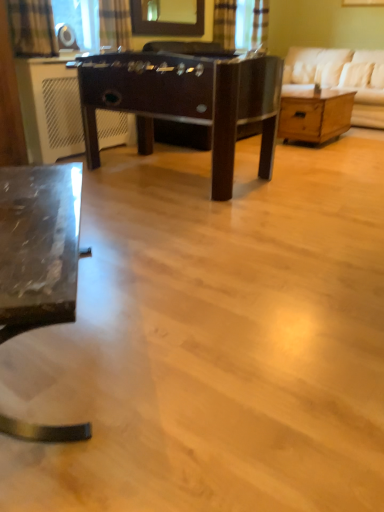
The height and width of the screenshot is (512, 384). I want to click on plaid fabric curtain at upper center, the 1th curtain from the back, so click(224, 23).

Where is `plaid fabric curtain at upper center, positioned as the 2th curtain in bottom-to-top order`? Image resolution: width=384 pixels, height=512 pixels. plaid fabric curtain at upper center, positioned as the 2th curtain in bottom-to-top order is located at coordinates (115, 24).

Locate an element on the screen. The width and height of the screenshot is (384, 512). white fabric couch at upper right is located at coordinates (342, 77).

Image resolution: width=384 pixels, height=512 pixels. What are the coordinates of `wooden drawer at right, arranged as the 1th table when viewed from the right` in the screenshot? It's located at pyautogui.click(x=314, y=114).

Identify the location of metallic glass desk at lower left. (39, 245).

This screenshot has width=384, height=512. What do you see at coordinates (32, 28) in the screenshot?
I see `plaid fabric curtain at upper left, which is the first curtain from bottom to top` at bounding box center [32, 28].

You are a GUI agent. You are given a task and a screenshot of the screen. Output one action in this format:
    pyautogui.click(x=<x>, y=<y>)
    Task: Click on the plaid fabric curtain at upper left, the third curtain when ordered from right to left
    
    Given the screenshot: What is the action you would take?
    pyautogui.click(x=32, y=28)

What do you see at coordinates (185, 101) in the screenshot? This screenshot has width=384, height=512. I see `dark brown wood foosball table at center, placed as the 2th table when sorted from back to front` at bounding box center [185, 101].

What are the coordinates of `plaid fabric curtain at upper center, which ranks as the third curtain in front-to-back order` in the screenshot? It's located at click(x=224, y=23).

There is a plaid fabric curtain at upper left, which appears as the 1th curtain when viewed from the front. Where is `mirror above it (from a real-world perspective)`? This screenshot has height=512, width=384. mirror above it (from a real-world perspective) is located at coordinates (168, 17).

Which object is closer to the camera, glossy glass mirror at upper center or plaid fabric curtain at upper left, the third curtain when ordered from right to left?

Positioned in front is plaid fabric curtain at upper left, the third curtain when ordered from right to left.

From a real-world perspective, is glossy glass mirror at upper center positioned under plaid fabric curtain at upper left, which is counted as the 1th curtain, starting from the left, based on gravity?

Actually, glossy glass mirror at upper center is physically above plaid fabric curtain at upper left, which is counted as the 1th curtain, starting from the left, in the real world.

Can plaid fabric curtain at upper left, the third curtain when ordered from right to left, be found inside glossy glass mirror at upper center?

Definitely not — plaid fabric curtain at upper left, the third curtain when ordered from right to left, is not inside glossy glass mirror at upper center.

Who is bigger, dark brown wood foosball table at center, the second table viewed from the right, or wooden drawer at right, the second table viewed from the front?

Bigger between the two is dark brown wood foosball table at center, the second table viewed from the right.

Do you think dark brown wood foosball table at center, placed as the 2th table when sorted from back to front, is within wooden drawer at right, which is counted as the 1th table, starting from the back, or outside of it?

dark brown wood foosball table at center, placed as the 2th table when sorted from back to front, is not enclosed by wooden drawer at right, which is counted as the 1th table, starting from the back.

From a real-world perspective, is dark brown wood foosball table at center, positioned as the first table in left-to-right order, physically below wooden drawer at right, which is the second table from left to right?

No.

Could you tell me if dark brown wood foosball table at center, the second table viewed from the right, is turned towards wooden drawer at right, the second table viewed from the front?

Yes, dark brown wood foosball table at center, the second table viewed from the right, is aimed at wooden drawer at right, the second table viewed from the front.

Is plaid fabric curtain at upper left, which is the first curtain from bottom to top, wider than plaid fabric curtain at upper center, which ranks as the 3th curtain in bottom-to-top order?

Indeed, plaid fabric curtain at upper left, which is the first curtain from bottom to top, has a greater width compared to plaid fabric curtain at upper center, which ranks as the 3th curtain in bottom-to-top order.

From a real-world perspective, who is located lower, plaid fabric curtain at upper left, the third curtain when ordered from right to left, or plaid fabric curtain at upper center, which ranks as the 1th curtain in right-to-left order?

In real-world perspective, plaid fabric curtain at upper left, the third curtain when ordered from right to left, is lower.

Does point (21, 0) appear closer or farther from the camera than point (224, 35)?

Point (21, 0) appears to be closer to the viewer than point (224, 35).

From the picture: From the image's perspective, is plaid fabric curtain at upper left, which is the first curtain from bottom to top, beneath plaid fabric curtain at upper center, which ranks as the 1th curtain in right-to-left order?

Yes, from the image's perspective, plaid fabric curtain at upper left, which is the first curtain from bottom to top, is beneath plaid fabric curtain at upper center, which ranks as the 1th curtain in right-to-left order.

From a real-world perspective, which curtain is the 3rd one above the dark brown wood foosball table at center, positioned as the first table in left-to-right order? Please provide its 2D coordinates.

[(224, 23)]

Is point (114, 63) farther from camera compared to point (227, 5)?

No, it is in front of (227, 5).

Is dark brown wood foosball table at center, placed as the 2th table when sorted from back to front, positioned beyond the bounds of plaid fabric curtain at upper center, which ranks as the 3th curtain in bottom-to-top order?

Yes, dark brown wood foosball table at center, placed as the 2th table when sorted from back to front, is located beyond the bounds of plaid fabric curtain at upper center, which ranks as the 3th curtain in bottom-to-top order.

In the scene shown: Are dark brown wood foosball table at center, positioned as the first table in left-to-right order, and plaid fabric curtain at upper center, which ranks as the 1th curtain in right-to-left order, beside each other?

dark brown wood foosball table at center, positioned as the first table in left-to-right order, and plaid fabric curtain at upper center, which ranks as the 1th curtain in right-to-left order, are not in contact.

From a real-world perspective, is wooden drawer at right, the second table viewed from the front, located beneath metallic glass desk at lower left?

No, from a real-world perspective, wooden drawer at right, the second table viewed from the front, is not beneath metallic glass desk at lower left.

Can you confirm if wooden drawer at right, the second table viewed from the front, is bigger than metallic glass desk at lower left?

Actually, wooden drawer at right, the second table viewed from the front, might be smaller than metallic glass desk at lower left.

Is point (325, 116) positioned after point (76, 242)?

Yes, it is.

Considering the sizes of objects dark brown wood foosball table at center, the second table viewed from the right, and plaid fabric curtain at upper center, the 2th curtain positioned from the back, in the image provided, who is smaller, dark brown wood foosball table at center, the second table viewed from the right, or plaid fabric curtain at upper center, the 2th curtain positioned from the back,?

plaid fabric curtain at upper center, the 2th curtain positioned from the back.

The image size is (384, 512). In order to click on the 1st curtain counting from the left of the dark brown wood foosball table at center, the second table viewed from the right in this screenshot , I will do `click(115, 24)`.

Is dark brown wood foosball table at center, placed as the 2th table when sorted from back to front, oriented away from plaid fabric curtain at upper center, the second curtain positioned from the right?

No, dark brown wood foosball table at center, placed as the 2th table when sorted from back to front, is not facing away from plaid fabric curtain at upper center, the second curtain positioned from the right.

Is dark brown wood foosball table at center, the first table viewed from the front, taller or shorter than plaid fabric curtain at upper center, placed as the 2th curtain when sorted from front to back?

Considering their sizes, dark brown wood foosball table at center, the first table viewed from the front, has more height than plaid fabric curtain at upper center, placed as the 2th curtain when sorted from front to back.

Which is in front, point (373, 59) or point (281, 126)?

The point (281, 126) is more forward.

Is white fabric couch at upper right bigger or smaller than wooden drawer at right, which is counted as the 1th table, starting from the back?

In the image, white fabric couch at upper right appears to be larger than wooden drawer at right, which is counted as the 1th table, starting from the back.

Is white fabric couch at upper right looking in the opposite direction of wooden drawer at right, arranged as the 1th table when viewed from the right?

No, white fabric couch at upper right's orientation is not away from wooden drawer at right, arranged as the 1th table when viewed from the right.

Identify the location of the 2nd curtain to the left when counting from the glossy glass mirror at upper center. The image size is (384, 512). (32, 28).

The image size is (384, 512). There is a wooden drawer at right, which is counted as the 1th table, starting from the back. What are the coordinates of `table above it (from a real-world perspective)` in the screenshot? It's located at (185, 101).

From the image, which object appears to be farther from metallic glass desk at lower left, plaid fabric curtain at upper left, which is counted as the 1th curtain, starting from the left, or plaid fabric curtain at upper center, positioned as the 2th curtain in bottom-to-top order?

plaid fabric curtain at upper center, positioned as the 2th curtain in bottom-to-top order, is positioned further to the anchor metallic glass desk at lower left.

Which object lies further to the anchor point wooden drawer at right, which is counted as the 1th table, starting from the back, white fabric couch at upper right or dark brown wood foosball table at center, positioned as the first table in left-to-right order?

dark brown wood foosball table at center, positioned as the first table in left-to-right order, is positioned further to the anchor wooden drawer at right, which is counted as the 1th table, starting from the back.

Which object lies further to the anchor point glossy glass mirror at upper center, plaid fabric curtain at upper center, the 1th curtain from the back, or wooden drawer at right, which is counted as the 1th table, starting from the back?

wooden drawer at right, which is counted as the 1th table, starting from the back, is further to glossy glass mirror at upper center.

When comparing their distances from plaid fabric curtain at upper center, the 2th curtain positioned from the back, does plaid fabric curtain at upper center, which ranks as the 1th curtain in right-to-left order, or white fabric couch at upper right seem further?

white fabric couch at upper right lies further to plaid fabric curtain at upper center, the 2th curtain positioned from the back, than the other object.

Which object lies nearer to the anchor point plaid fabric curtain at upper center, the 2th curtain positioned from the back, plaid fabric curtain at upper left, the 3th curtain from the back, or glossy glass mirror at upper center?

glossy glass mirror at upper center is closer to plaid fabric curtain at upper center, the 2th curtain positioned from the back.

Looking at the image, which one is located closer to dark brown wood foosball table at center, placed as the 2th table when sorted from back to front, white fabric couch at upper right or metallic glass desk at lower left?

metallic glass desk at lower left is positioned closer to the anchor dark brown wood foosball table at center, placed as the 2th table when sorted from back to front.

Which object lies nearer to the anchor point wooden drawer at right, the second table viewed from the front, plaid fabric curtain at upper center, the second curtain positioned from the right, or plaid fabric curtain at upper left, which is the first curtain from bottom to top?

plaid fabric curtain at upper center, the second curtain positioned from the right, is closer to wooden drawer at right, the second table viewed from the front.

Which object lies nearer to the anchor point plaid fabric curtain at upper center, the 1th curtain from the back, glossy glass mirror at upper center or dark brown wood foosball table at center, placed as the 2th table when sorted from back to front?

Based on the image, glossy glass mirror at upper center appears to be nearer to plaid fabric curtain at upper center, the 1th curtain from the back.

Find the location of a particular element. The height and width of the screenshot is (512, 384). mirror between dark brown wood foosball table at center, the first table viewed from the front, and plaid fabric curtain at upper center, which ranks as the third curtain in front-to-back order, along the z-axis is located at coordinates (168, 17).

Where is `mirror located between metallic glass desk at lower left and wooden drawer at right, the second table viewed from the front, in the depth direction`? The image size is (384, 512). mirror located between metallic glass desk at lower left and wooden drawer at right, the second table viewed from the front, in the depth direction is located at coordinates (168, 17).

Image resolution: width=384 pixels, height=512 pixels. Find the location of `curtain situated between glossy glass mirror at upper center and white fabric couch at upper right from left to right`. curtain situated between glossy glass mirror at upper center and white fabric couch at upper right from left to right is located at coordinates (224, 23).

Where is `curtain between plaid fabric curtain at upper center, positioned as the 2th curtain in bottom-to-top order, and wooden drawer at right, arranged as the 1th table when viewed from the right`? The width and height of the screenshot is (384, 512). curtain between plaid fabric curtain at upper center, positioned as the 2th curtain in bottom-to-top order, and wooden drawer at right, arranged as the 1th table when viewed from the right is located at coordinates click(x=224, y=23).